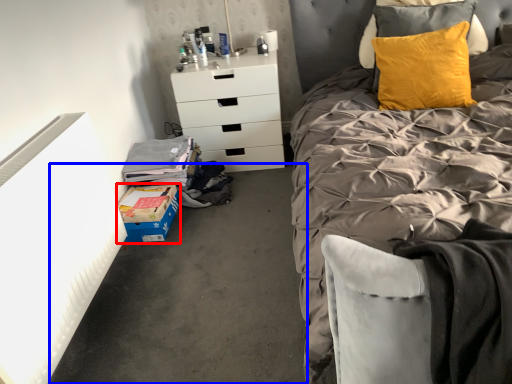
Question: Which object appears closest to the camera in this image, cardboard box (highlighted by a red box) or concrete (highlighted by a blue box)?

Choices:
 (A) cardboard box
 (B) concrete

Answer: (B)